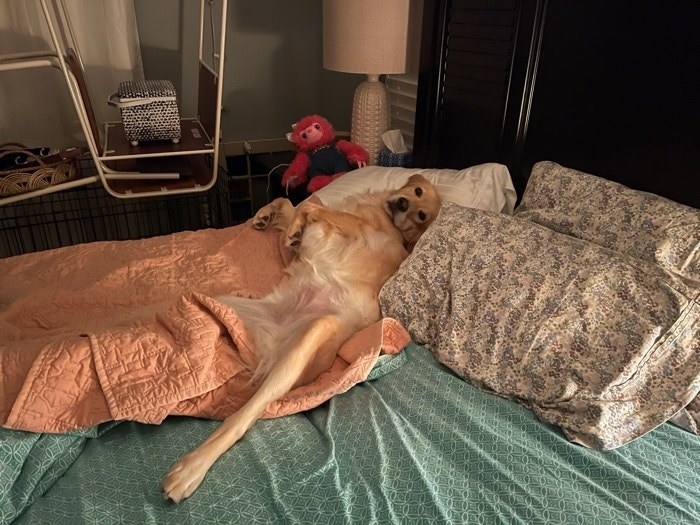
The width and height of the screenshot is (700, 525). Find the location of `light orange blanket`. light orange blanket is located at coordinates (147, 262).